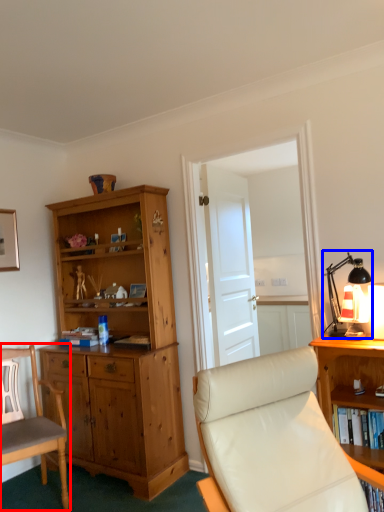
Question: Which object is further to the camera taking this photo, chair (highlighted by a red box) or table lamp (highlighted by a blue box)?

Choices:
 (A) chair
 (B) table lamp

Answer: (A)